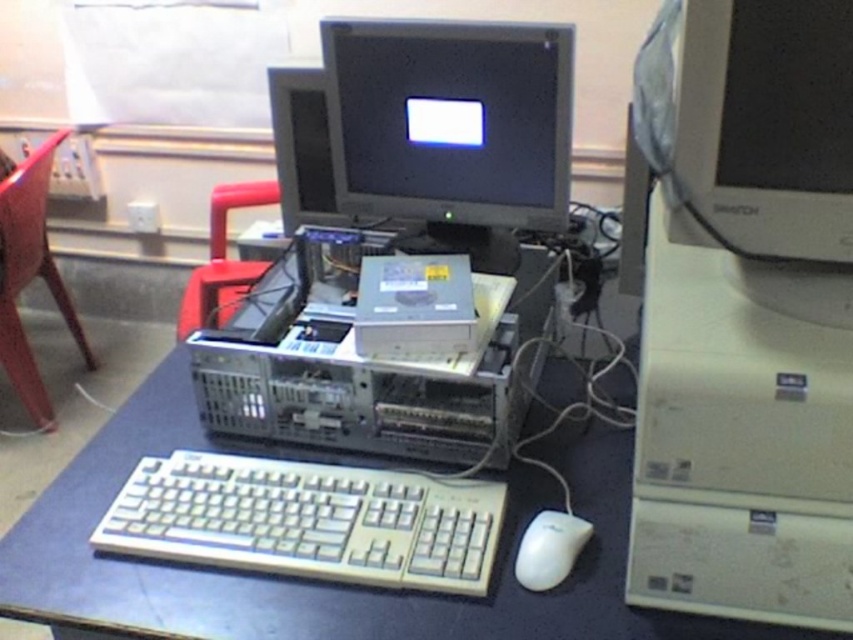
Question: Can you confirm if black plastic table at center is bigger than matte gray monitor at upper right?

Choices:
 (A) no
 (B) yes

Answer: (B)

Question: Estimate the real-world distances between objects in this image. Which object is closer to the white plastic keyboard at lower center?

Choices:
 (A) black plastic table at center
 (B) white matte mouse at lower right
 (C) metallic red chair at upper center
 (D) red plastic chair at left

Answer: (A)

Question: Does red plastic chair at left have a lesser width compared to metallic red chair at upper center?

Choices:
 (A) yes
 (B) no

Answer: (B)

Question: Which point is farther from the camera taking this photo?

Choices:
 (A) 505,490
 (B) 780,10

Answer: (A)

Question: Is white plastic keyboard at lower center below red plastic chair at left?

Choices:
 (A) no
 (B) yes

Answer: (B)

Question: Which point is closer to the camera?

Choices:
 (A) (213, 260)
 (B) (102, 456)
 (C) (525, 106)

Answer: (B)